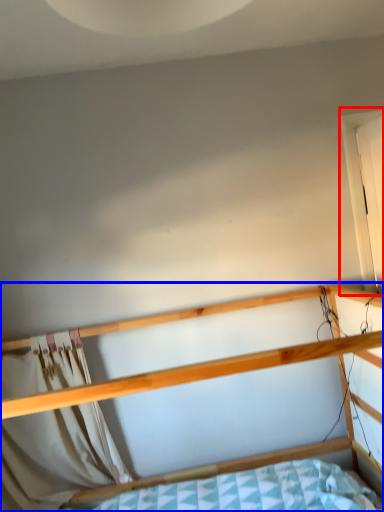
Question: Which of the following is the farthest to the observer, window (highlighted by a red box) or bed (highlighted by a blue box)?

Choices:
 (A) window
 (B) bed

Answer: (A)